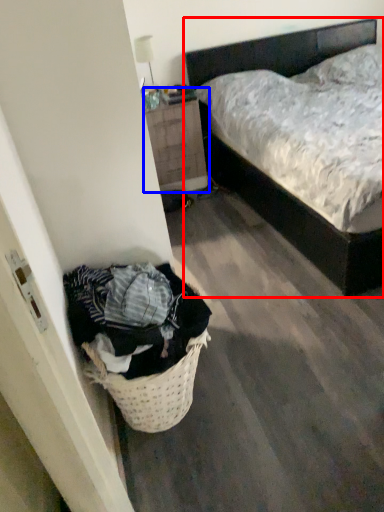
Question: Which object appears farthest to the camera in this image, bed (highlighted by a red box) or nightstand (highlighted by a blue box)?

Choices:
 (A) bed
 (B) nightstand

Answer: (B)